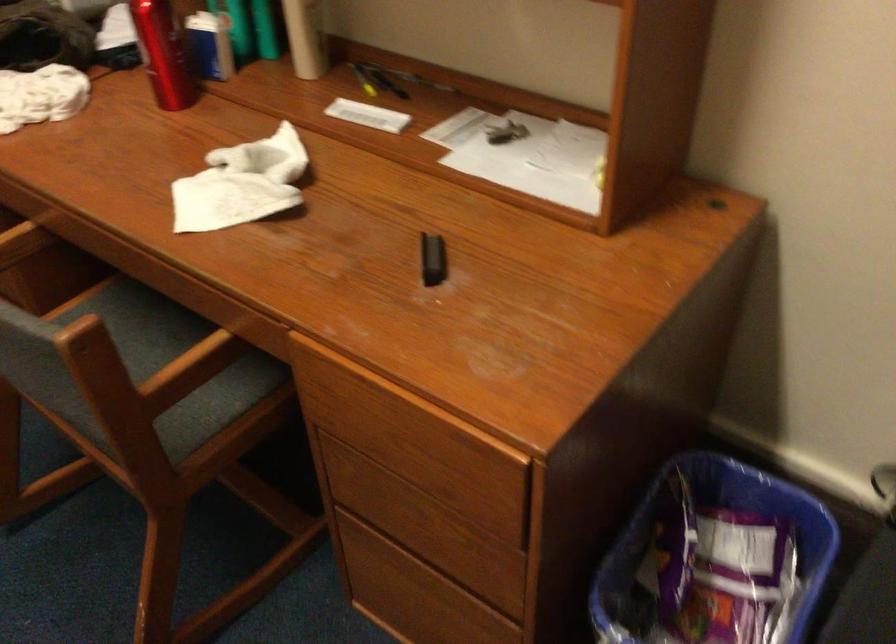
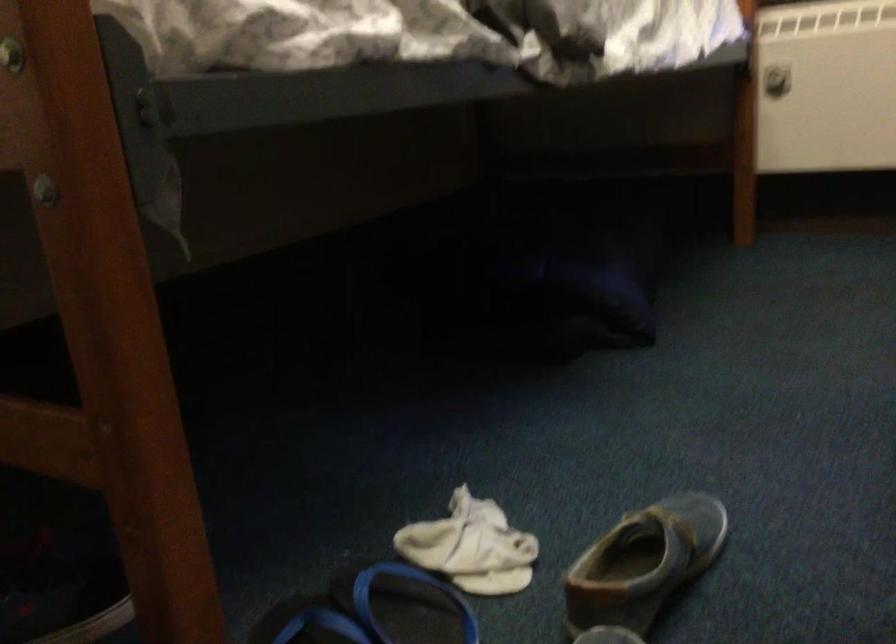
Question: The first image is from the beginning of the video and the second image is from the end. How did the camera likely rotate when shooting the video?

Choices:
 (A) Left
 (B) Right
 (C) Up
 (D) Down

Answer: (A)